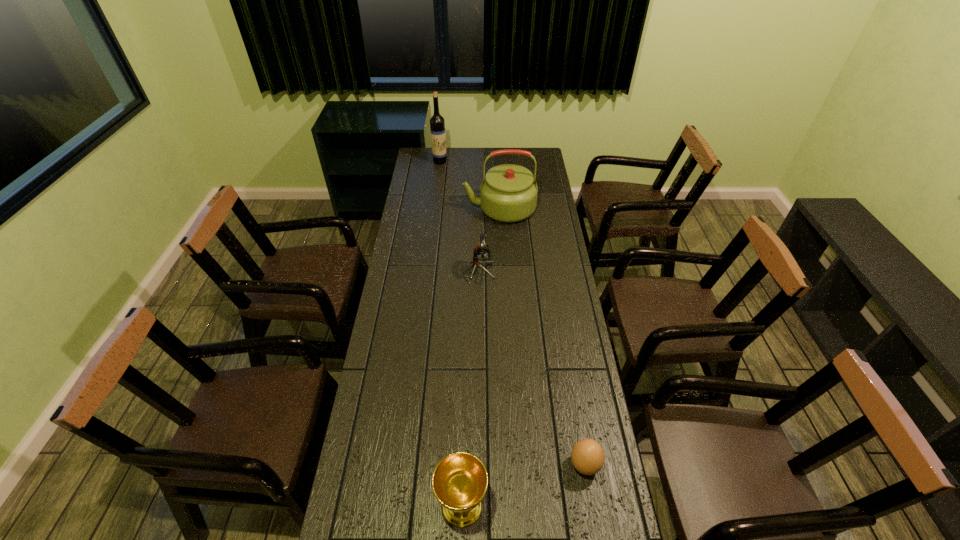
Identify the location of the leftmost object. The image size is (960, 540). (437, 124).

Identify the location of the tallest object. coord(437,124).

Locate an element on the screen. This screenshot has height=540, width=960. the second farthest object is located at coordinates (508, 193).

The height and width of the screenshot is (540, 960). I want to click on kettle, so pyautogui.click(x=508, y=193).

Identify the location of earphone. (481, 254).

The image size is (960, 540). Identify the location of chalice. (460, 480).

Locate an element on the screen. The image size is (960, 540). boiled egg is located at coordinates (587, 455).

The height and width of the screenshot is (540, 960). Identify the location of vacant space situated on the label of the tallest object. (439, 175).

You are a GUI agent. You are given a task and a screenshot of the screen. Output one action in this format:
    pyautogui.click(x=<x>, y=<y>)
    Task: Click on the free region located 0.220m at the spout of the fourth nearest object
    This screenshot has width=960, height=540.
    Given the screenshot: What is the action you would take?
    pyautogui.click(x=418, y=209)

Find the location of `vacant space located 0.080m at the spout of the fourth nearest object`. vacant space located 0.080m at the spout of the fourth nearest object is located at coordinates (446, 209).